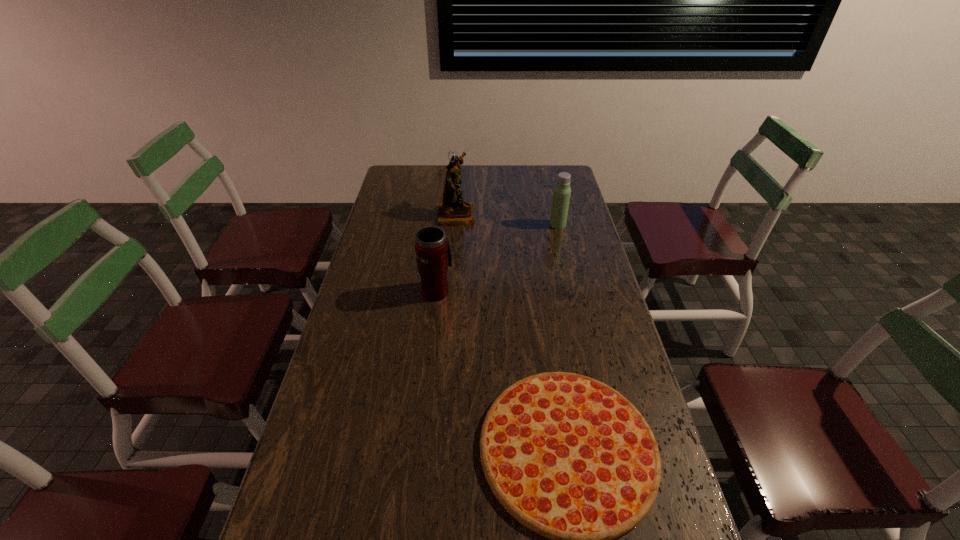
Locate which object is the second closest to the pizza. Please provide its 2D coordinates. Your answer should be formatted as a tuple, i.e. [(x, y)], where the tuple contains the x and y coordinates of a point satisfying the conditions above.

[(561, 195)]

Locate an element on the screen. free space that satisfies the following two spatial constraints: 1. on the side with the handle of the right thermos bottle; 2. on the left side of the third farthest object is located at coordinates (444, 225).

Identify the location of vacant point that satisfies the following two spatial constraints: 1. on the side with the handle of the nearer thermos bottle; 2. on the right side of the right thermos bottle. The width and height of the screenshot is (960, 540). (444, 225).

You are a GUI agent. You are given a task and a screenshot of the screen. Output one action in this format:
    pyautogui.click(x=<x>, y=<y>)
    Task: Click on the free space that satisfies the following two spatial constraints: 1. on the side with the handle of the nearer thermos bottle; 2. on the left side of the farther thermos bottle
    The image size is (960, 540).
    Given the screenshot: What is the action you would take?
    pyautogui.click(x=444, y=225)

Find the location of a particular element. Image resolution: width=960 pixels, height=540 pixels. blank space that satisfies the following two spatial constraints: 1. on the front-facing side of the farther thermos bottle; 2. on the right side of the figurine is located at coordinates (455, 225).

The height and width of the screenshot is (540, 960). I want to click on vacant region that satisfies the following two spatial constraints: 1. on the front-facing side of the farther thermos bottle; 2. on the left side of the figurine, so click(x=455, y=225).

Identify the location of vacant region that satisfies the following two spatial constraints: 1. on the side with the handle of the third farthest object; 2. on the right side of the farther thermos bottle. The image size is (960, 540). (444, 225).

What are the coordinates of `blank space that satisfies the following two spatial constraints: 1. on the side with the handle of the farther thermos bottle; 2. on the right side of the second nearest object` in the screenshot? It's located at (444, 225).

You are a GUI agent. You are given a task and a screenshot of the screen. Output one action in this format:
    pyautogui.click(x=<x>, y=<y>)
    Task: Click on the vacant region that satisfies the following two spatial constraints: 1. on the side with the handle of the farther thermos bottle; 2. on the left side of the left thermos bottle
    The width and height of the screenshot is (960, 540).
    Given the screenshot: What is the action you would take?
    pyautogui.click(x=444, y=225)

Identify the location of free space that satisfies the following two spatial constraints: 1. on the back side of the right thermos bottle; 2. on the front-facing side of the figurine. Image resolution: width=960 pixels, height=540 pixels. 556,214.